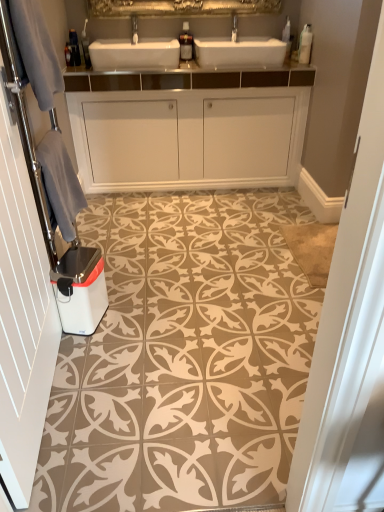
I want to click on free spot above white glossy dishwasher at lower left (from a real-world perspective), so click(74, 260).